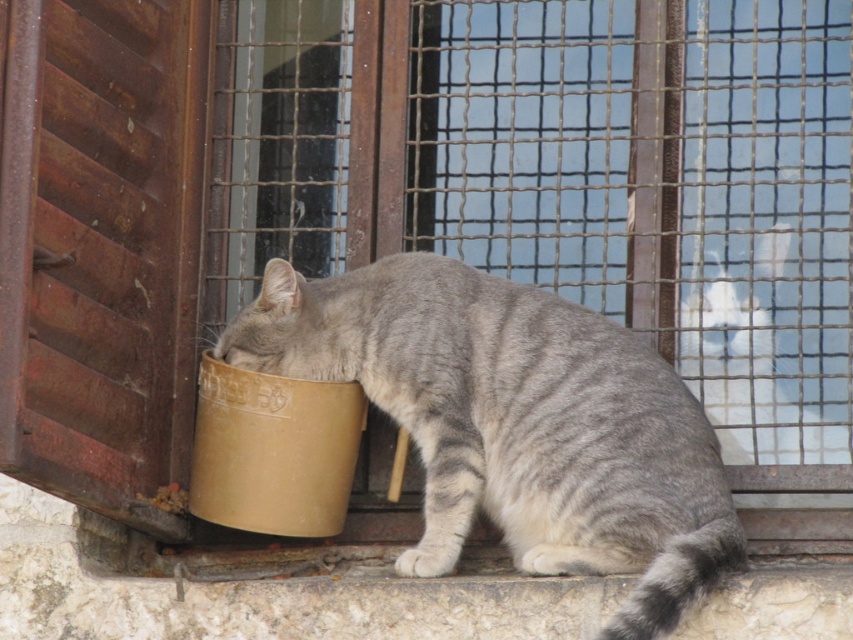
From the picture: You are standing at the window with a metal grid screen and want to reach the gray tabby cat sitting on the stone ledge. The cat is near two specific points marked as point 1 at coordinates (x=598, y=428) and point 2 at coordinates (x=757, y=275). Which point should you aim for to get closer to the cat?

You should aim for point 1 at coordinates (x=598, y=428) because it is in front of point 2 at coordinates (x=757, y=275), meaning it is closer to your position at the window.

You are a photographer trying to capture a closeup of the gray striped fur at center. Based on the scene description, can you determine if you need to adjust your camera position to get a closer shot?

The gray striped fur at center is 16.92 meters away from camera, so you need to move closer or use a zoom lens to get a closer shot.